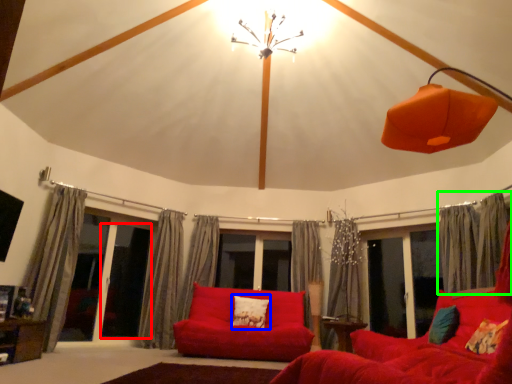
Question: Which object is positioned closest to screen door (highlighted by a red box)? Select from pillow (highlighted by a blue box) and curtain (highlighted by a green box).

Choices:
 (A) pillow
 (B) curtain

Answer: (A)